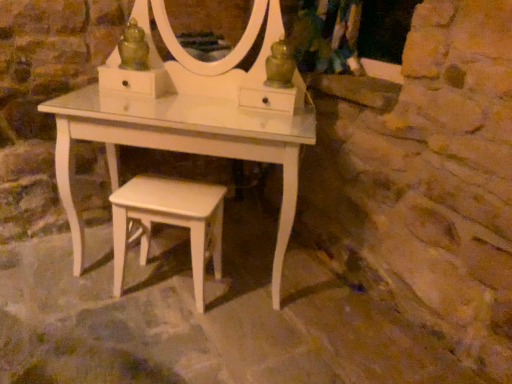
This screenshot has height=384, width=512. In order to click on vacant space underneath white matte stool at center (from a real-world perspective) in this screenshot , I will do `click(167, 292)`.